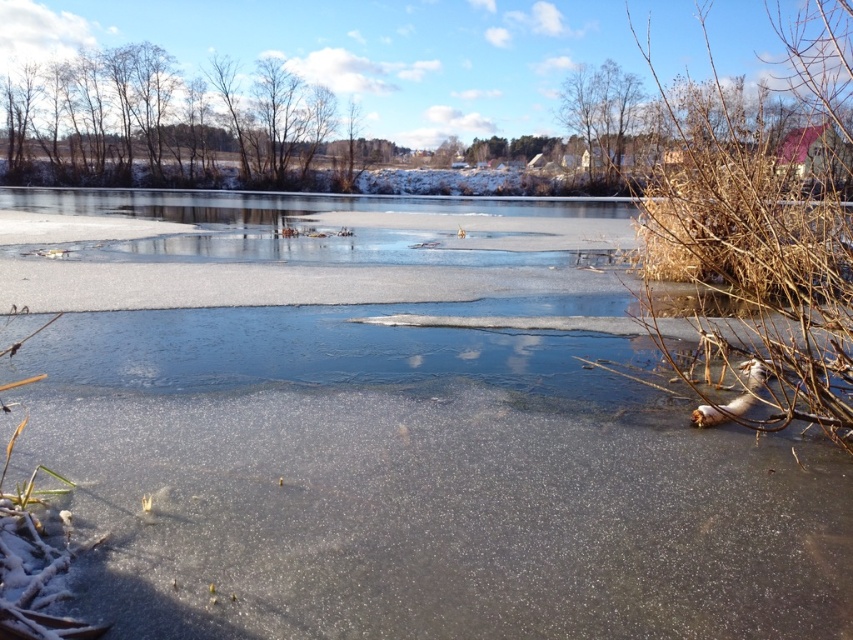
You are an observer standing in the winter landscape. You notice the brown dry branches at right and the bare branches at left. Which of these two branches is positioned higher up in the image?

The brown dry branches at right is located above bare branches at left, so it is positioned higher up in the image.

You are a wildlife researcher planning to set up a camera trap between the brown dry branches at right and the bare branches at left. The camera has a 30 meter range. Will the camera be able to capture both objects in its range?

The distance between the brown dry branches at right and the bare branches at left is 31.63 meters, which exceeds the camera trap range of 30 meters. Therefore, the camera cannot capture both objects simultaneously.

You are an observer standing in the winter landscape. You see the brown dry branches at right and the bare branches at left. Which one is positioned to the east if the sun is setting in the west?

The brown dry branches at right is to the right of bare branches at left. Since the sun is setting in the west, the right side of the image would correspond to the east direction. Therefore, the brown dry branches at right is positioned to the east.